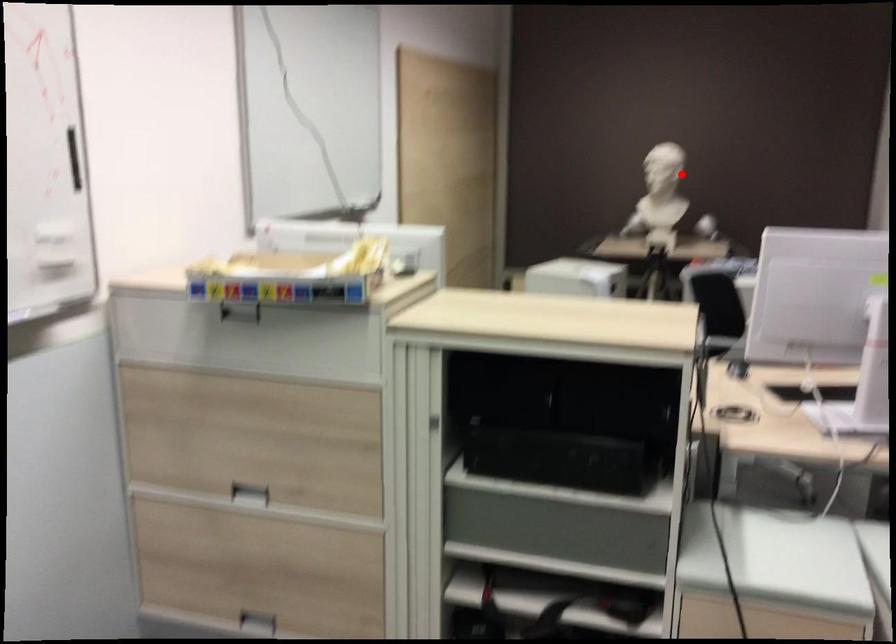
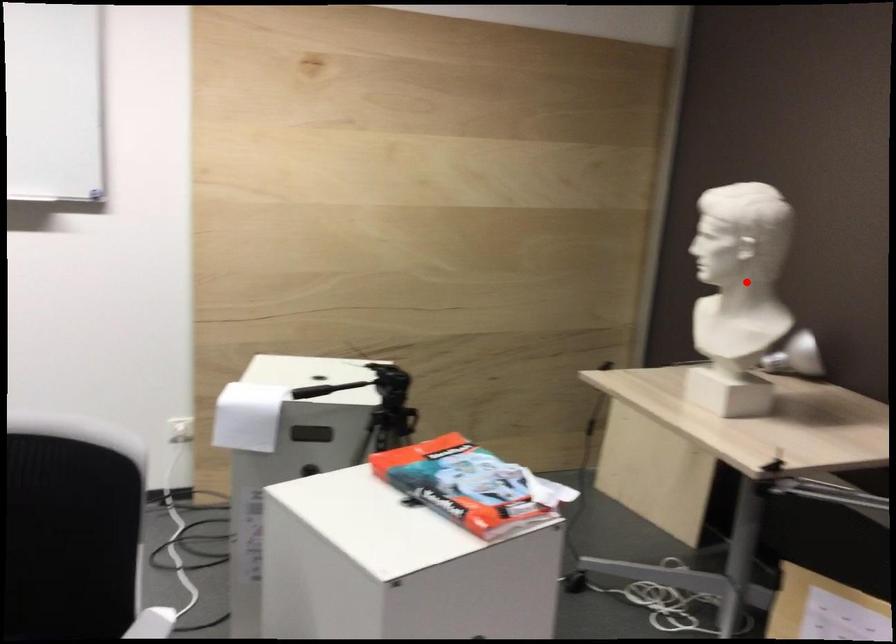
I am providing you with two images of the same scene from different viewpoints. A red point is marked on the first image and another point is marked on the second image. Does the point marked in image1 correspond to the same location as the one in image2?

Yes